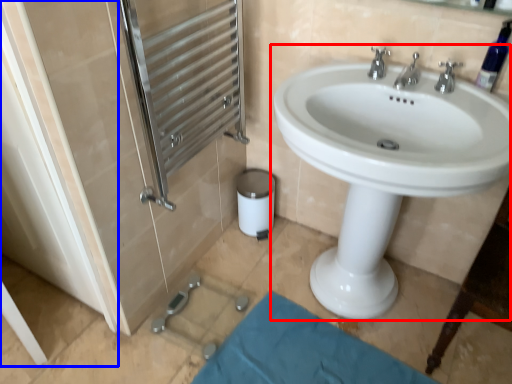
Question: Among these objects, which one is farthest to the camera, sink (highlighted by a red box) or screen door (highlighted by a blue box)?

Choices:
 (A) sink
 (B) screen door

Answer: (B)